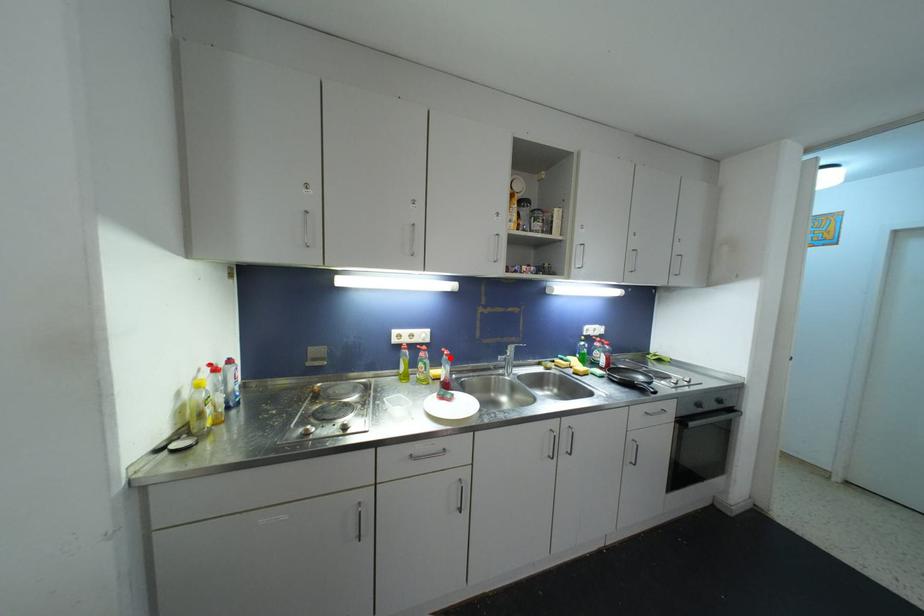
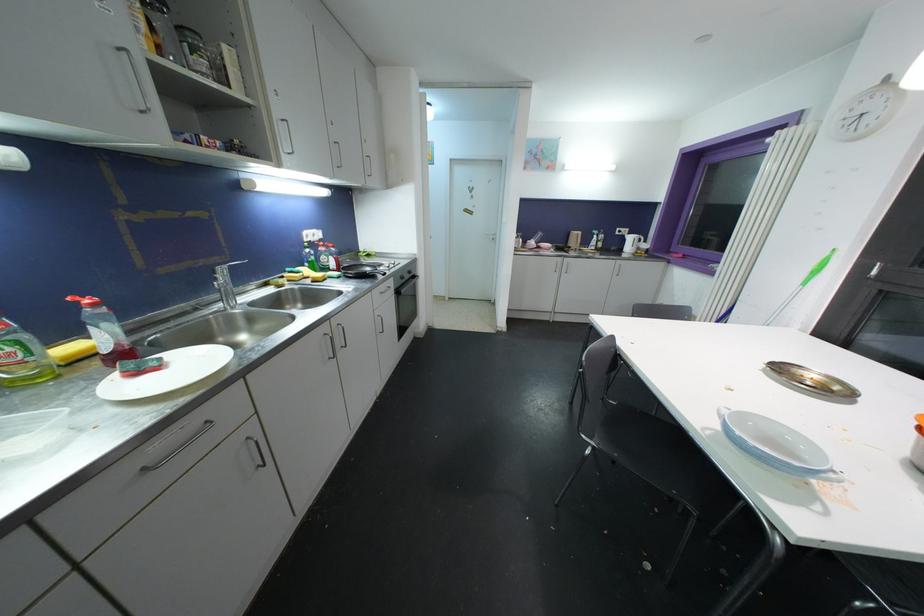
Locate, in the second image, the point that corresponds to the highlighted location in the first image.

(98, 308)